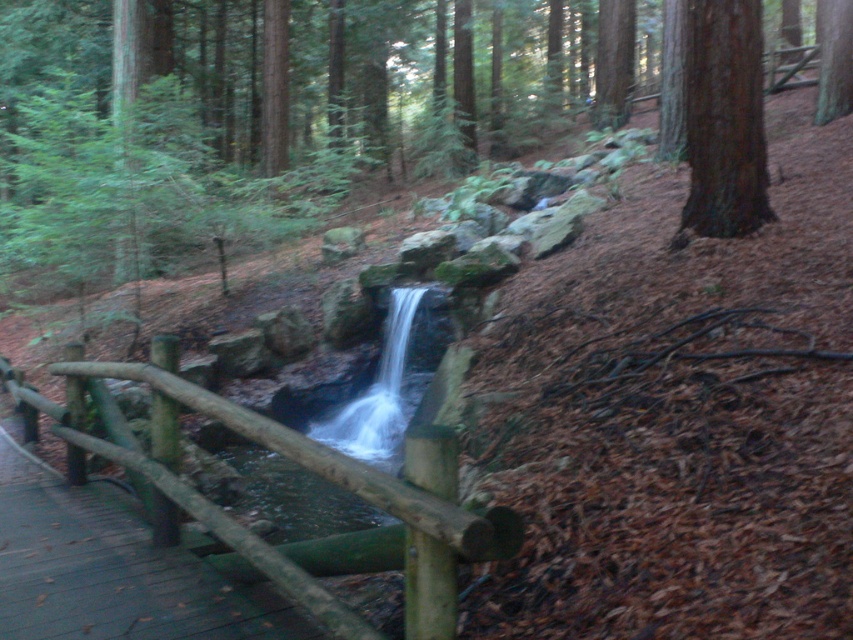
You are a hiker trying to cross the shallow pool near the waterfall. You see the green mossy rock at center and the green rough bark tree at upper right. Which object is wider, and can you step on the wider one to cross?

The green mossy rock at center is wider than the green rough bark tree at upper right. Since the rock is wider, you can step on it to cross the shallow pool safely.

You are a hiker who wants to place a small bench between the green mossy rock at center and the green rough bark tree at upper right. Based on their positions, which object should the bench be closer to?

The bench should be placed closer to the green mossy rock at center because it is positioned on the left side of the green rough bark tree at upper right, meaning the rock is to the left of the tree. Therefore, placing the bench between them would require it to be closer to the rock to maintain balance.